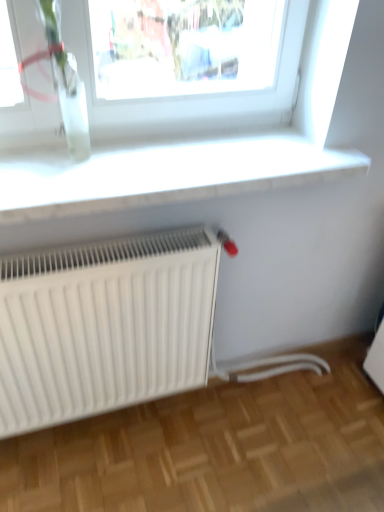
Question: Is white smooth window sill at upper center far from clear glass vase at upper left?

Choices:
 (A) yes
 (B) no

Answer: (B)

Question: From a real-world perspective, is white smooth window sill at upper center physically below clear glass vase at upper left?

Choices:
 (A) no
 (B) yes

Answer: (B)

Question: Is white smooth window sill at upper center closer to the viewer compared to clear glass vase at upper left?

Choices:
 (A) yes
 (B) no

Answer: (B)

Question: Does white smooth window sill at upper center have a greater height compared to clear glass vase at upper left?

Choices:
 (A) no
 (B) yes

Answer: (A)

Question: Is white smooth window sill at upper center surrounding clear glass vase at upper left?

Choices:
 (A) yes
 (B) no

Answer: (B)

Question: Considering the relative positions of white smooth window sill at upper center and clear glass vase at upper left in the image provided, is white smooth window sill at upper center to the left or to the right of clear glass vase at upper left?

Choices:
 (A) left
 (B) right

Answer: (B)

Question: Is white smooth window sill at upper center taller or shorter than clear glass vase at upper left?

Choices:
 (A) short
 (B) tall

Answer: (A)

Question: Is white smooth window sill at upper center inside the boundaries of clear glass vase at upper left, or outside?

Choices:
 (A) inside
 (B) outside

Answer: (B)

Question: Considering the positions of white smooth window sill at upper center and clear glass vase at upper left in the image, is white smooth window sill at upper center wider or thinner than clear glass vase at upper left?

Choices:
 (A) wide
 (B) thin

Answer: (A)

Question: Looking at their shapes, would you say white matte radiator at lower left is wider or thinner than white smooth window sill at upper center?

Choices:
 (A) thin
 (B) wide

Answer: (A)

Question: From their relative heights in the image, would you say white matte radiator at lower left is taller or shorter than white smooth window sill at upper center?

Choices:
 (A) tall
 (B) short

Answer: (A)

Question: Visually, is white matte radiator at lower left positioned to the left or to the right of white smooth window sill at upper center?

Choices:
 (A) right
 (B) left

Answer: (B)

Question: Is white matte radiator at lower left inside or outside of white smooth window sill at upper center?

Choices:
 (A) outside
 (B) inside

Answer: (A)

Question: Is clear glass vase at upper left inside or outside of white smooth window sill at upper center?

Choices:
 (A) outside
 (B) inside

Answer: (A)

Question: Is point (69, 132) positioned closer to the camera than point (43, 167)?

Choices:
 (A) closer
 (B) farther

Answer: (B)